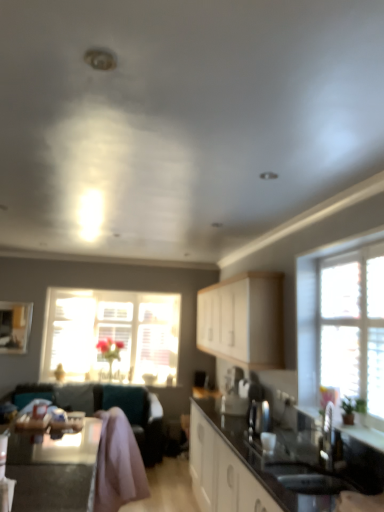
Locate an element on the screen. The width and height of the screenshot is (384, 512). white matte cabinet at center is located at coordinates point(243,320).

The image size is (384, 512). What do you see at coordinates (54, 469) in the screenshot?
I see `black glossy table at lower left` at bounding box center [54, 469].

This screenshot has height=512, width=384. Describe the element at coordinates (111, 335) in the screenshot. I see `translucent glass window at center, which is the 1th window in back-to-front order` at that location.

Identify the location of teal fabric couch at lower left. (123, 410).

The height and width of the screenshot is (512, 384). Identify the location of black glossy countertop at center. (257, 467).

What is the approximate width of white textured window at right, the 2th window when ordered from back to front?

The width of white textured window at right, the 2th window when ordered from back to front, is 5.32 inches.

I want to click on white matte cabinet at center, so click(243, 320).

How far apart are satin silver kettle at center and white textured window at right, the 2th window when ordered from left to right?

satin silver kettle at center is 23.39 inches away from white textured window at right, the 2th window when ordered from left to right.

Is satin silver kettle at center bigger than white textured window at right, which ranks as the first window in front-to-back order?

Actually, satin silver kettle at center might be smaller than white textured window at right, which ranks as the first window in front-to-back order.

Is the surface of satin silver kettle at center in direct contact with white textured window at right, the 2th window when ordered from back to front?

No, satin silver kettle at center is not beside white textured window at right, the 2th window when ordered from back to front.

Which point is more forward, (250, 310) or (85, 384)?

The point (250, 310) is more forward.

Measure the distance between white matte cabinet at center and teal fabric couch at lower left.

A distance of 1.28 meters exists between white matte cabinet at center and teal fabric couch at lower left.

From a real-world perspective, does white matte cabinet at center sit lower than teal fabric couch at lower left?

No, from a real-world perspective, white matte cabinet at center is not beneath teal fabric couch at lower left.

Between white matte cabinet at center and teal fabric couch at lower left, which one appears on the right side from the viewer's perspective?

From the viewer's perspective, white matte cabinet at center appears more on the right side.

Which is behind, point (306, 486) or point (308, 398)?

Point (308, 398)

Considering the sizes of black glossy sink at lower right and white textured window at right, the 2th window when ordered from left to right, in the image, is black glossy sink at lower right wider or thinner than white textured window at right, the 2th window when ordered from left to right,?

Considering their sizes, black glossy sink at lower right looks broader than white textured window at right, the 2th window when ordered from left to right.

Considering the sizes of objects black glossy sink at lower right and white textured window at right, the 2th window when ordered from left to right, in the image provided, who is smaller, black glossy sink at lower right or white textured window at right, the 2th window when ordered from left to right,?

black glossy sink at lower right is smaller.

Considering the relative sizes of black glossy sink at lower right and white textured window at right, acting as the 1th window starting from the right, in the image provided, is black glossy sink at lower right taller than white textured window at right, acting as the 1th window starting from the right,?

In fact, black glossy sink at lower right may be shorter than white textured window at right, acting as the 1th window starting from the right.

Measure the distance between teal fabric couch at lower left and black glossy sink at lower right.

teal fabric couch at lower left and black glossy sink at lower right are 7.17 feet apart.

Which is closer to the camera, (98, 395) or (326, 485)?

Clearly, point (98, 395) is more distant from the camera than point (326, 485).

What's the angular difference between teal fabric couch at lower left and black glossy sink at lower right's facing directions?

They differ by 89.5 degrees in their facing directions.

From the picture: Is teal fabric couch at lower left inside the boundaries of black glossy sink at lower right, or outside?

teal fabric couch at lower left is not inside black glossy sink at lower right, it's outside.

Between point (204, 495) and point (314, 292), which one is positioned behind?

The point (204, 495) is farther.

Is white textured window at right, acting as the 1th window starting from the right, completely or partially inside black glossy countertop at center?

Actually, white textured window at right, acting as the 1th window starting from the right, is outside black glossy countertop at center.

Could you measure the distance between black glossy countertop at center and white textured window at right, which ranks as the first window in front-to-back order?

black glossy countertop at center is 80.44 centimeters away from white textured window at right, which ranks as the first window in front-to-back order.

Is black glossy countertop at center wider or thinner than white textured window at right, which ranks as the first window in front-to-back order?

Clearly, black glossy countertop at center has more width compared to white textured window at right, which ranks as the first window in front-to-back order.

Is the position of white matte cabinet at center less distant than that of translucent glass window at center, marked as the second window in a right-to-left arrangement?

Yes, the depth of white matte cabinet at center is less than that of translucent glass window at center, marked as the second window in a right-to-left arrangement.

Can you confirm if white matte cabinet at center is positioned to the left of translucent glass window at center, which is the first window in left-to-right order?

In fact, white matte cabinet at center is to the right of translucent glass window at center, which is the first window in left-to-right order.

Looking at this image, would you say white matte cabinet at center contains translucent glass window at center, which is the second window from front to back?

No.

Find the location of a particular element. cabinetry in front of the translucent glass window at center, marked as the second window in a right-to-left arrangement is located at coordinates (243, 320).

From the image's perspective, which is below, white textured window at right, which ranks as the first window in front-to-back order, or satin silver kettle at center?

satin silver kettle at center.

Is white textured window at right, which ranks as the first window in front-to-back order, oriented away from satin silver kettle at center?

white textured window at right, which ranks as the first window in front-to-back order, does not have its back to satin silver kettle at center.

From a real-world perspective, does white textured window at right, the 2th window when ordered from left to right, stand above satin silver kettle at center?

Yes.

Can you confirm if white textured window at right, the 2th window when ordered from left to right, is taller than satin silver kettle at center?

Yes.

The width and height of the screenshot is (384, 512). I want to click on window that is the 2nd one above the satin silver kettle at center (from a real-world perspective), so click(316, 310).

The image size is (384, 512). Identify the location of cabinetry on the right side of teal fabric couch at lower left. (243, 320).

From the image, which object appears to be nearer to black glossy countertop at center, black glossy sink at lower right or white textured window at right, which ranks as the first window in front-to-back order?

Among the two, black glossy sink at lower right is located nearer to black glossy countertop at center.

When comparing their distances from white matte cabinet at center, does translucent glass window at center, marked as the second window in a right-to-left arrangement, or satin silver kettle at center seem closer?

satin silver kettle at center lies closer to white matte cabinet at center than the other object.

From the image, which object appears to be nearer to satin silver kettle at center, white matte cabinet at center or white textured window at right, the 2th window when ordered from back to front?

white textured window at right, the 2th window when ordered from back to front, is closer to satin silver kettle at center.

Estimate the real-world distances between objects in this image. Which object is further from white matte cabinet at center, white textured window at right, the 2th window when ordered from back to front, or black glossy countertop at center?

black glossy countertop at center.

Considering their positions, is black glossy sink at lower right positioned closer to white textured window at right, acting as the 1th window starting from the right, than black glossy countertop at center?

black glossy countertop at center is closer to white textured window at right, acting as the 1th window starting from the right.

When comparing their distances from black glossy countertop at center, does white textured window at right, the 2th window when ordered from back to front, or translucent glass window at center, which is the 1th window in back-to-front order, seem further?

translucent glass window at center, which is the 1th window in back-to-front order, lies further to black glossy countertop at center than the other object.

From the image, which object appears to be nearer to teal fabric couch at lower left, white textured window at right, the 2th window when ordered from back to front, or white matte cabinet at center?

white matte cabinet at center is positioned closer to the anchor teal fabric couch at lower left.

Considering their positions, is black glossy sink at lower right positioned further to satin silver kettle at center than white matte cabinet at center?

Among the two, white matte cabinet at center is located further to satin silver kettle at center.

Where is `appliance located between black glossy table at lower left and white matte cabinet at center in the depth direction`? This screenshot has height=512, width=384. appliance located between black glossy table at lower left and white matte cabinet at center in the depth direction is located at coordinates (259, 416).

This screenshot has height=512, width=384. I want to click on cabinetry between white textured window at right, the 2th window when ordered from back to front, and translucent glass window at center, marked as the second window in a right-to-left arrangement, from front to back, so click(243, 320).

Locate an element on the screen. This screenshot has width=384, height=512. appliance positioned between black glossy table at lower left and translucent glass window at center, which is the 1th window in back-to-front order, from near to far is located at coordinates (259, 416).

The height and width of the screenshot is (512, 384). Identify the location of sink between black glossy countertop at center and satin silver kettle at center along the z-axis. (307, 478).